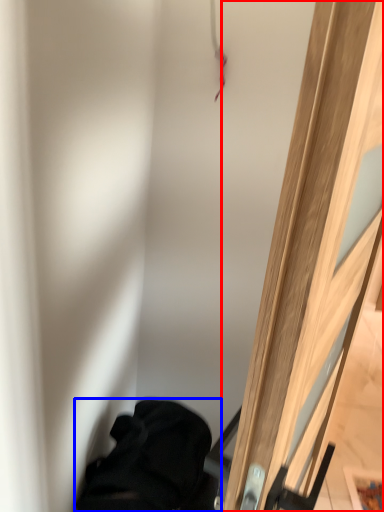
Question: Which object is further to the camera taking this photo, door (highlighted by a red box) or furniture (highlighted by a blue box)?

Choices:
 (A) door
 (B) furniture

Answer: (B)